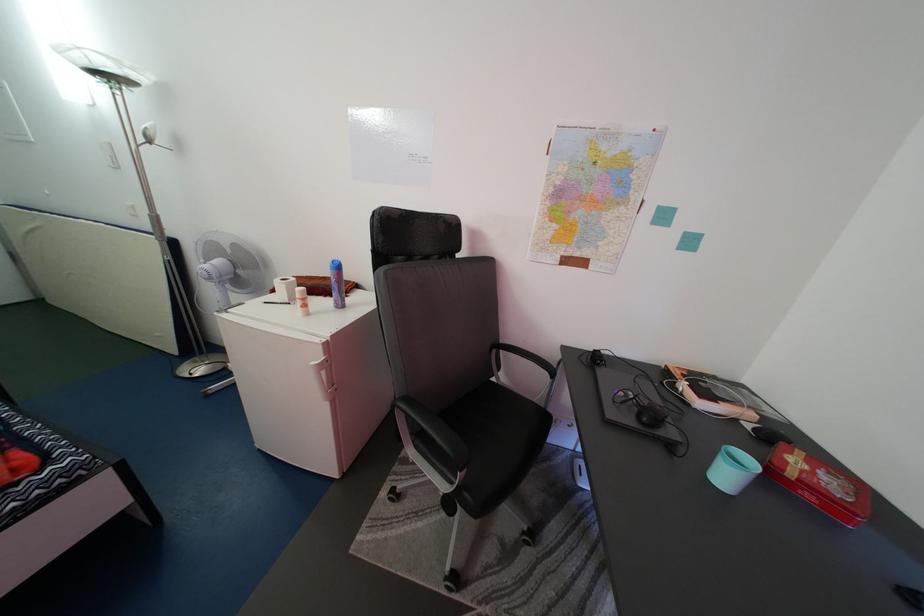
Find the location of a particular element. This screenshot has height=616, width=924. orange covered book is located at coordinates (708, 397).